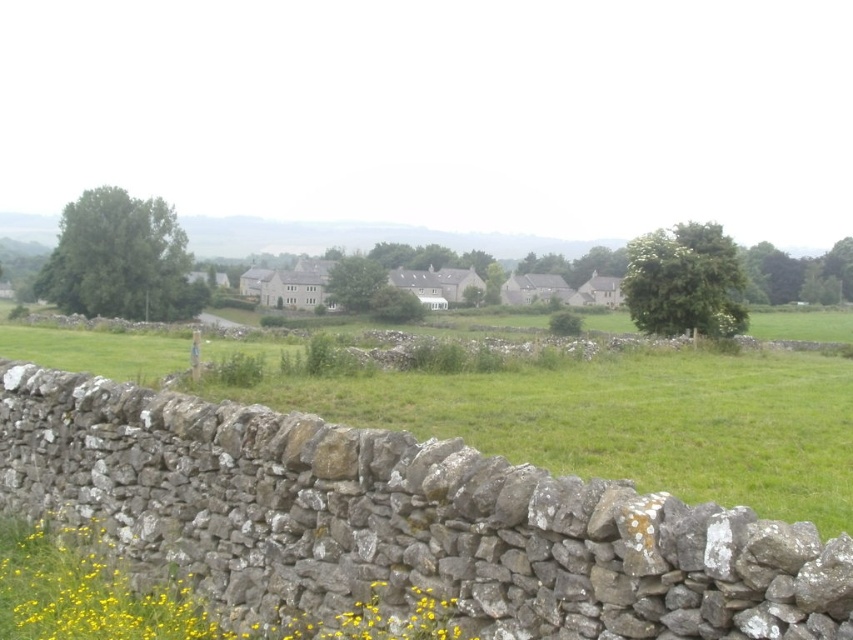
Does green grassy field at center have a greater height compared to yellow grass at lower left?

Yes.

Is point (749, 376) behind point (94, 636)?

Yes, point (749, 376) is farther from viewer.

Is point (846, 477) farther from camera compared to point (82, 554)?

Yes, it is.

Locate an element on the screen. This screenshot has height=640, width=853. green grassy field at center is located at coordinates (618, 419).